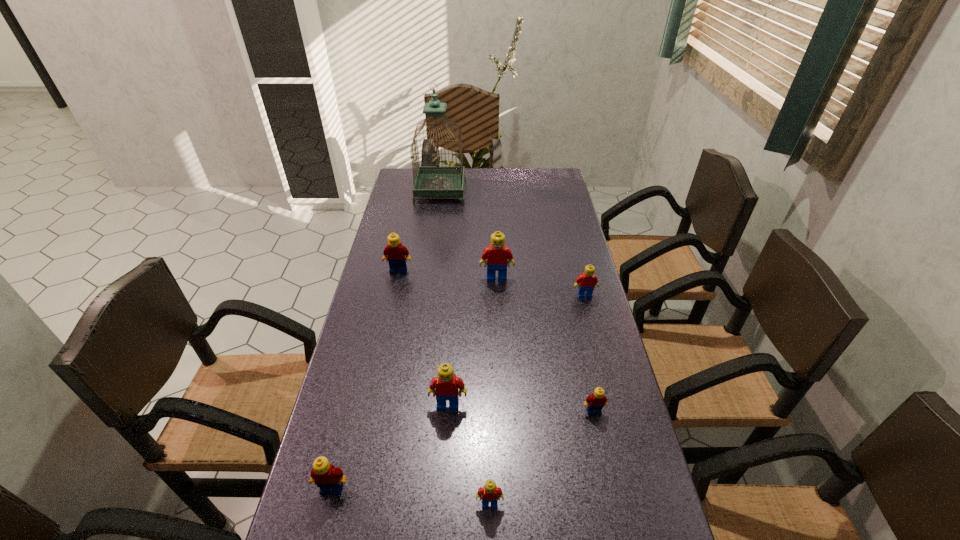
This screenshot has height=540, width=960. What are the coordinates of `the nearest yellow Lego` in the screenshot? It's located at (328, 478).

Locate an element on the screen. The width and height of the screenshot is (960, 540). the smallest yellow Lego is located at coordinates click(595, 402).

Identify the location of the second nearest yellow Lego. (595, 402).

Locate an element on the screen. The width and height of the screenshot is (960, 540). the nearest object is located at coordinates (489, 492).

This screenshot has height=540, width=960. I want to click on the nearest Lego, so click(489, 492).

Locate an element on the screen. vacant space situated at the door of the tallest object is located at coordinates coord(519,191).

This screenshot has height=540, width=960. In order to click on free location located 0.180m on the face of the seventh shortest object in this screenshot , I will do [x=498, y=322].

At what (x,y) coordinates should I click in order to perform the action: click on free point located 0.270m on the front-facing side of the farthest yellow Lego. Please return your answer as a coordinate pair (x, y). The width and height of the screenshot is (960, 540). Looking at the image, I should click on (385, 335).

You are a GUI agent. You are given a task and a screenshot of the screen. Output one action in this format:
    pyautogui.click(x=<x>, y=<y>)
    Task: Click on the vacant space located on the face of the third farthest red Lego
    The width and height of the screenshot is (960, 540).
    Given the screenshot: What is the action you would take?
    pyautogui.click(x=441, y=525)

Where is `free space located on the face of the second smallest red Lego`? This screenshot has width=960, height=540. free space located on the face of the second smallest red Lego is located at coordinates (614, 411).